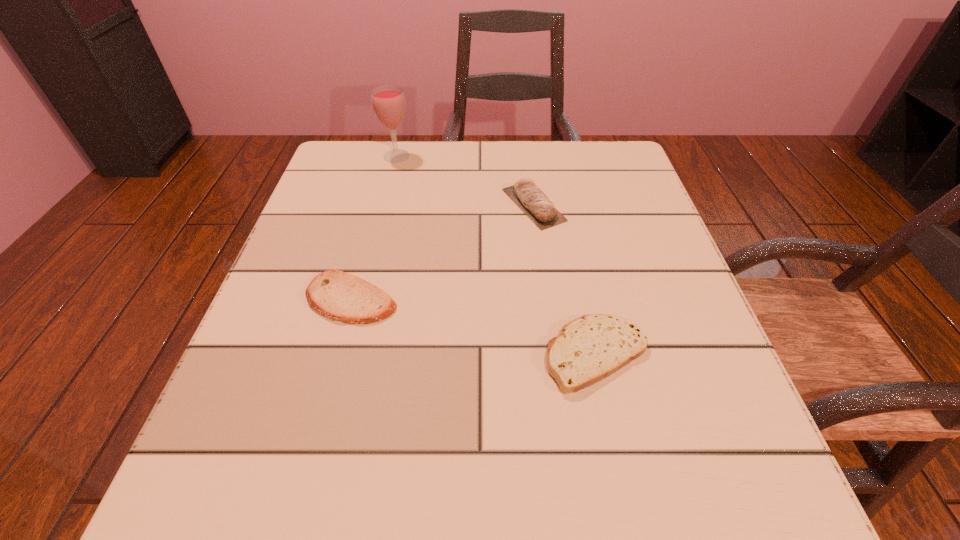
Locate an element on the screen. This screenshot has height=540, width=960. wineglass that is at the left edge is located at coordinates (388, 101).

The height and width of the screenshot is (540, 960). In order to click on pita bread that is at the left edge in this screenshot , I will do `click(339, 296)`.

The height and width of the screenshot is (540, 960). Find the location of `object located at the right edge`. object located at the right edge is located at coordinates tap(593, 347).

Where is `object that is at the far left corner`? object that is at the far left corner is located at coordinates (388, 101).

The height and width of the screenshot is (540, 960). I want to click on vacant area at the far edge, so click(x=502, y=147).

Image resolution: width=960 pixels, height=540 pixels. Find the location of `free space at the near edge of the desktop`. free space at the near edge of the desktop is located at coordinates (629, 494).

The image size is (960, 540). I want to click on vacant space at the left edge, so click(x=296, y=350).

Where is `free region at the right edge of the desktop`? Image resolution: width=960 pixels, height=540 pixels. free region at the right edge of the desktop is located at coordinates (710, 379).

In the image, there is a desktop. Find the location of `free region at the far left corner`. free region at the far left corner is located at coordinates (338, 159).

This screenshot has height=540, width=960. Find the location of `blank space at the near left corner`. blank space at the near left corner is located at coordinates (193, 508).